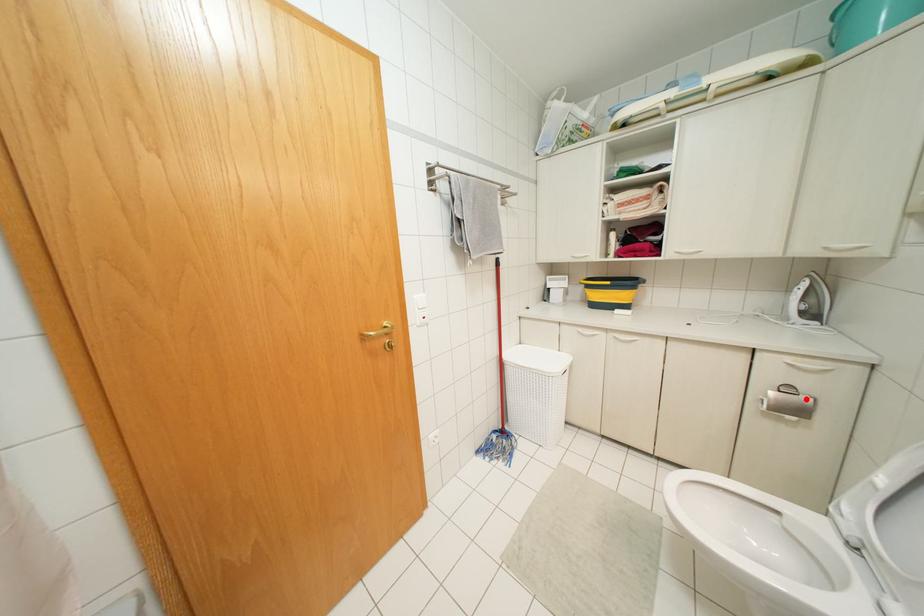
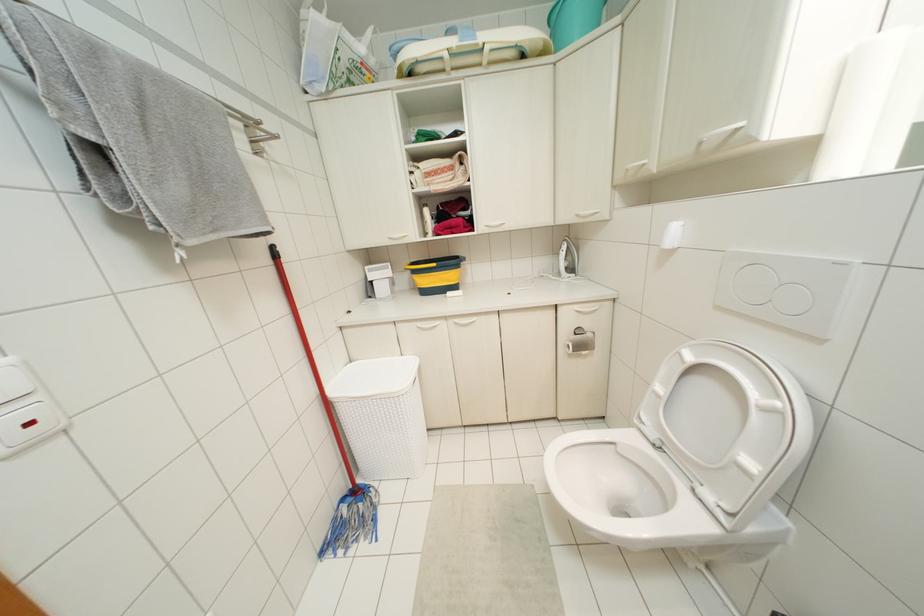
Question: I am providing you with two images of the same scene from different viewpoints. Image1 has a red point marked. In image2, the corresponding 3D location appears at what relative position? Reply with the corresponding letter.

Choices:
 (A) Closer
 (B) Farther

Answer: (B)